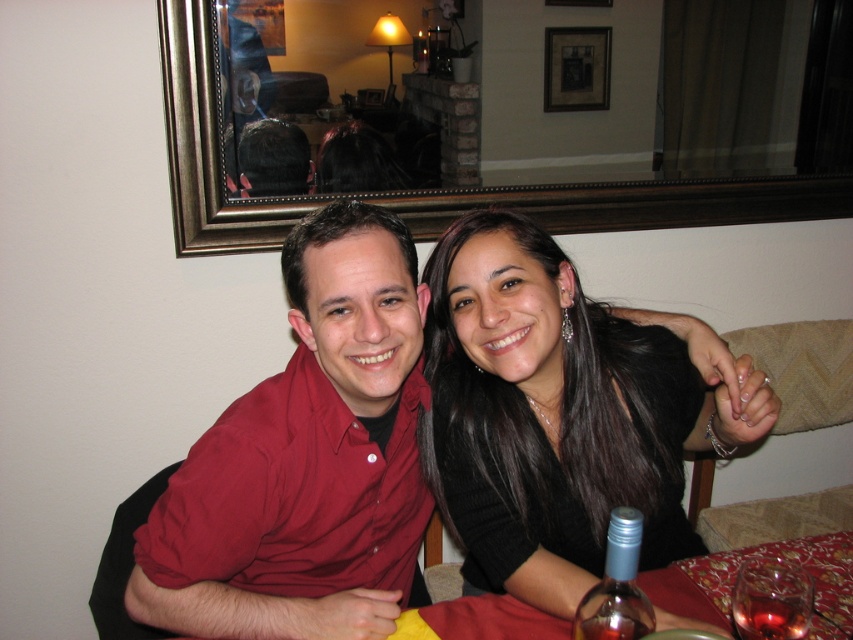
Is point (840, 627) positioned in front of point (781, 636)?

No, it is behind (781, 636).

Between silky red tablecloth at lower center and translucent glass wine at lower right, which one is positioned higher?

translucent glass wine at lower right is above.

The width and height of the screenshot is (853, 640). Identify the location of silky red tablecloth at lower center. (735, 572).

Consider the image. Measure the distance from silky red tablecloth at lower center to transparent glass at lower right.

silky red tablecloth at lower center is 5.32 inches from transparent glass at lower right.

Is silky red tablecloth at lower center closer to camera compared to transparent glass at lower right?

No.

Which is in front, point (519, 637) or point (805, 634)?

Point (805, 634) is more forward.

The width and height of the screenshot is (853, 640). What are the coordinates of `silky red tablecloth at lower center` in the screenshot? It's located at (735, 572).

Is clear glass bottle at lower right above wooden picture frame at upper center?

Incorrect, clear glass bottle at lower right is not positioned above wooden picture frame at upper center.

Which is above, clear glass bottle at lower right or wooden picture frame at upper center?

wooden picture frame at upper center is above.

Does point (605, 540) come farther from viewer compared to point (554, 83)?

No, it is in front of (554, 83).

What are the coordinates of `clear glass bottle at lower right` in the screenshot? It's located at (616, 586).